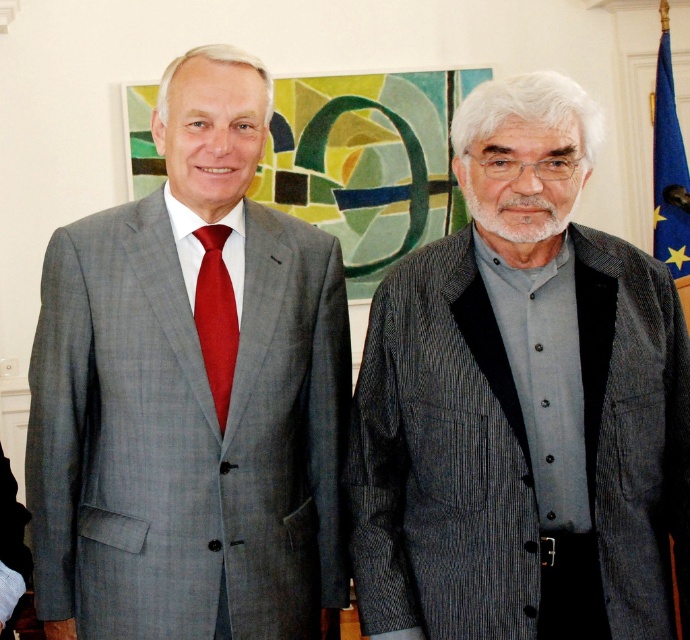
Question: Is matte gray suit at left wider than blue fabric flag at right?

Choices:
 (A) no
 (B) yes

Answer: (B)

Question: Does gray striped blazer at center have a lesser width compared to matte gray suit at left?

Choices:
 (A) yes
 (B) no

Answer: (B)

Question: Which of the following is the farthest from the observer?

Choices:
 (A) matte gray suit at left
 (B) blue fabric flag at right
 (C) matte red tie at left
 (D) gray striped blazer at center

Answer: (B)

Question: Does gray striped blazer at center come behind matte gray suit at left?

Choices:
 (A) no
 (B) yes

Answer: (A)

Question: Which point is farther to the camera?

Choices:
 (A) blue fabric flag at right
 (B) matte gray suit at left
 (C) matte red tie at left

Answer: (A)

Question: Which object is closer to the camera taking this photo?

Choices:
 (A) gray striped blazer at center
 (B) matte gray suit at left
 (C) blue fabric flag at right

Answer: (A)